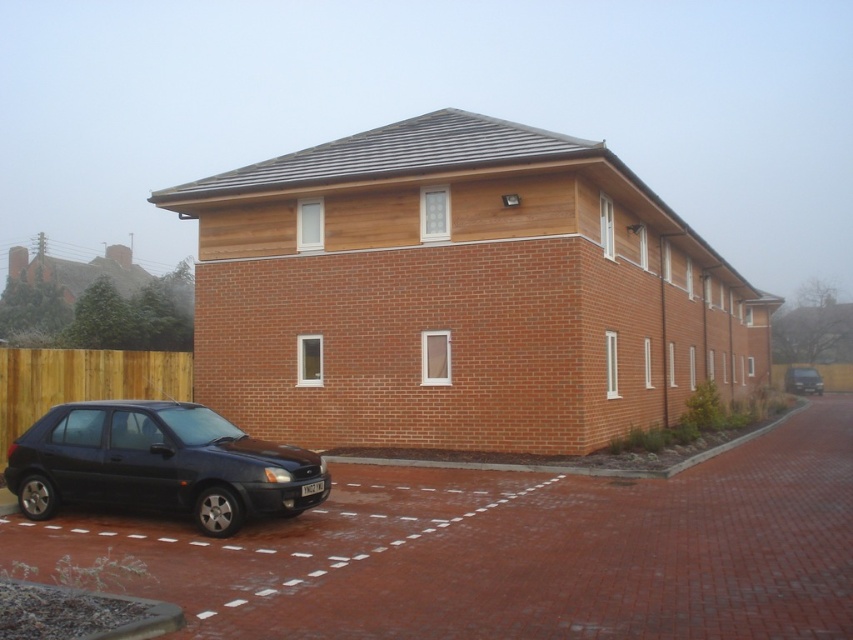
You are a delivery person trying to park a 5.5 meter long truck in the driveway. The brick at lower left marks the start of the driveway, and the matte black suv at right is parked at the end. Can you fit your truck between them without overlapping either?

The distance between the brick at lower left and the matte black suv at right is 50.92 meters. Since the truck is only 5.5 meters long, there is ample space to park it between them without overlapping.

You are a delivery person who needs to park your van between the matte black car at lower left and the matte black suv at right. Can you fit your van which is 5 meters long in the space between them?

The distance between the matte black car at lower left and the matte black suv at right is 55.83 meters, so yes, the van can fit between them as the space is much longer than the van.

You are standing at the entrance of the driveway of the modern two story residential building. You see a point marked at coordinates (160, 465). What object is located at that point?

The point at (160, 465) marks the matte black car at lower left.